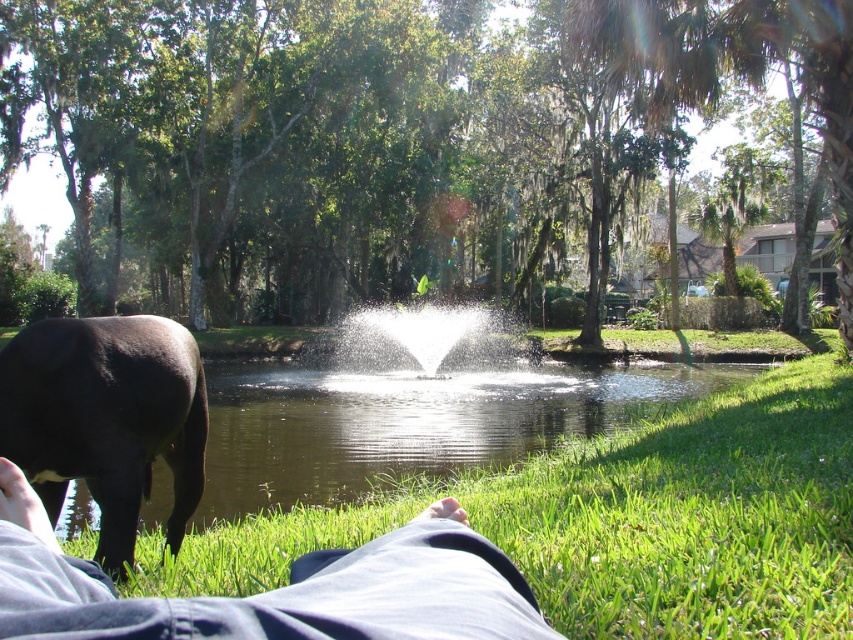
You are a photographer trying to capture the height difference between the green grassy pond at center and the white frothy water at center. Which one appears taller in the photo?

The white frothy water at center appears taller than the green grassy pond at center in the photo.

You are a photographer trying to capture the black glossy bull at lower left and the white frothy water at center in one shot. Based on their heights, which object should you focus on first to ensure both are in frame?

The black glossy bull at lower left is shorter than the white frothy water at center, so you should focus on the white frothy water at center first to ensure both are in frame.

You are a photographer trying to capture a photo of the denim pants at lower left and the black glossy bull at lower left. You want to ensure both are in focus. Given that your camera has a depth of field that can cover 6 feet, will both subjects be in focus if you focus on the midpoint between them?

The denim pants at lower left and black glossy bull at lower left are 5.92 feet apart from each other. Since the distance between them is less than 6 feet, focusing on the midpoint will keep both within the depth of field, so both will be in focus.